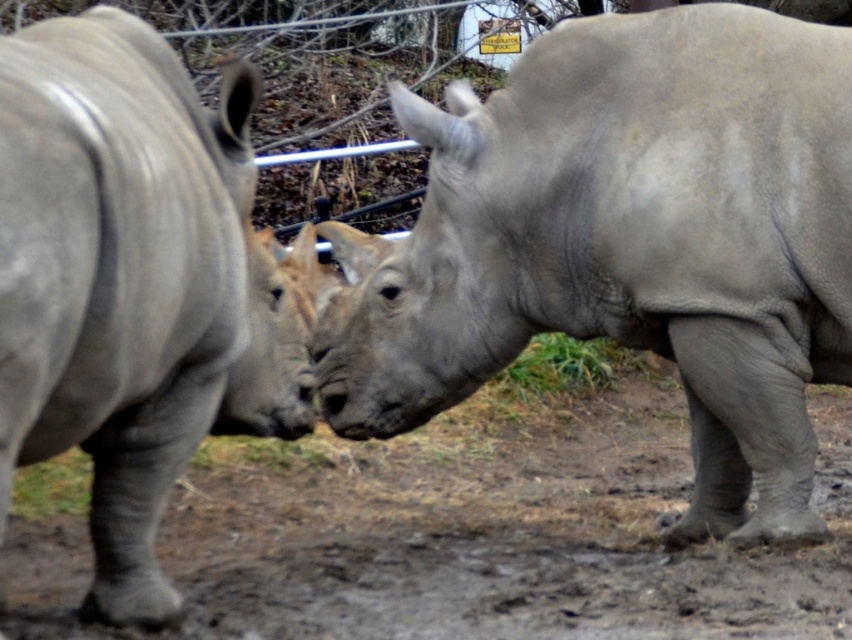
Between gray matte rhinoceros at center and gray matte rhinoceros at left, which one is positioned lower?

gray matte rhinoceros at left is lower down.

Is gray matte rhinoceros at center wider than gray matte rhinoceros at left?

Correct, the width of gray matte rhinoceros at center exceeds that of gray matte rhinoceros at left.

Between point (550, 196) and point (235, 307), which one is positioned in front?

Positioned in front is point (235, 307).

Image resolution: width=852 pixels, height=640 pixels. I want to click on gray matte rhinoceros at center, so click(632, 241).